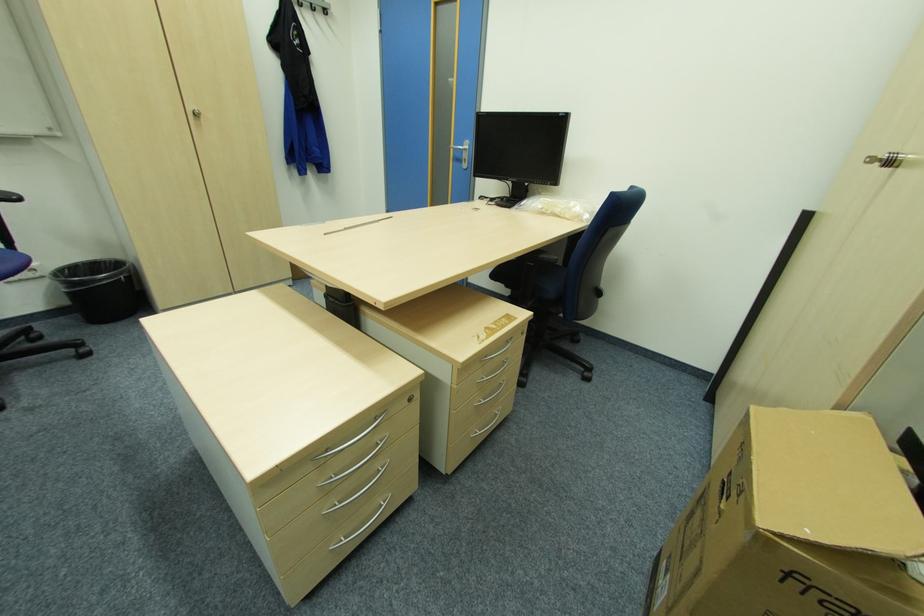
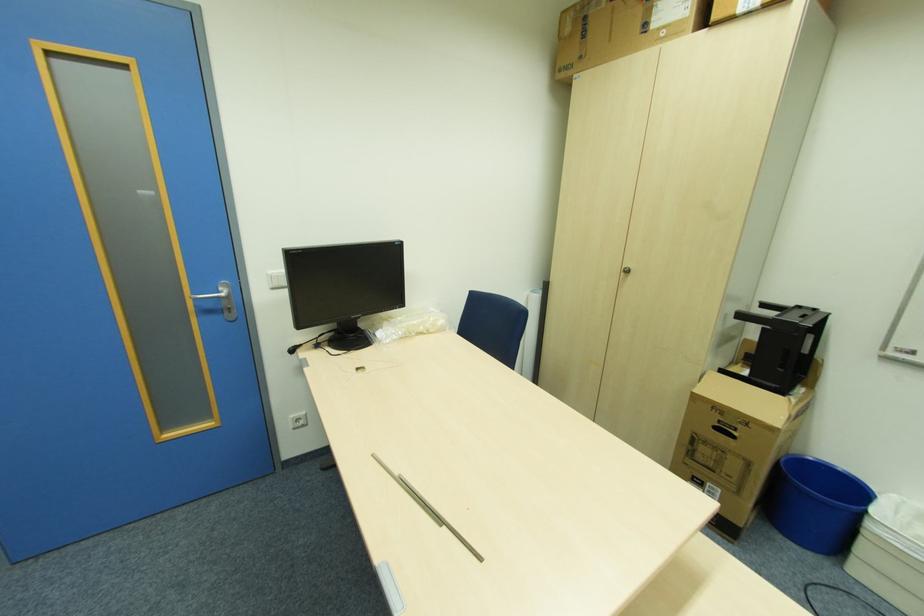
Find the pixel in the second image that matches point (467, 161) in the first image.

(234, 310)